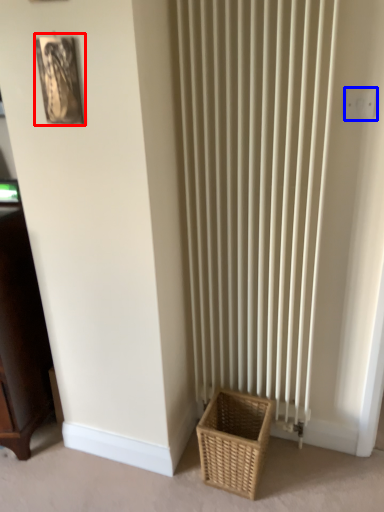
Question: Among these objects, which one is farthest to the camera, picture frame (highlighted by a red box) or electric outlet (highlighted by a blue box)?

Choices:
 (A) picture frame
 (B) electric outlet

Answer: (B)